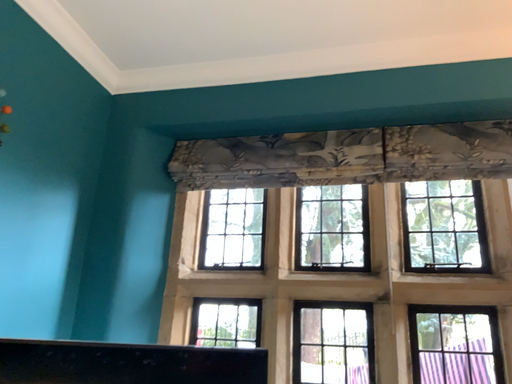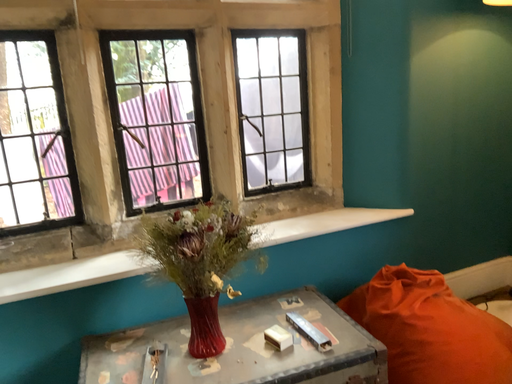
Question: Which way did the camera rotate in the video?

Choices:
 (A) rotated upward
 (B) rotated downward

Answer: (B)